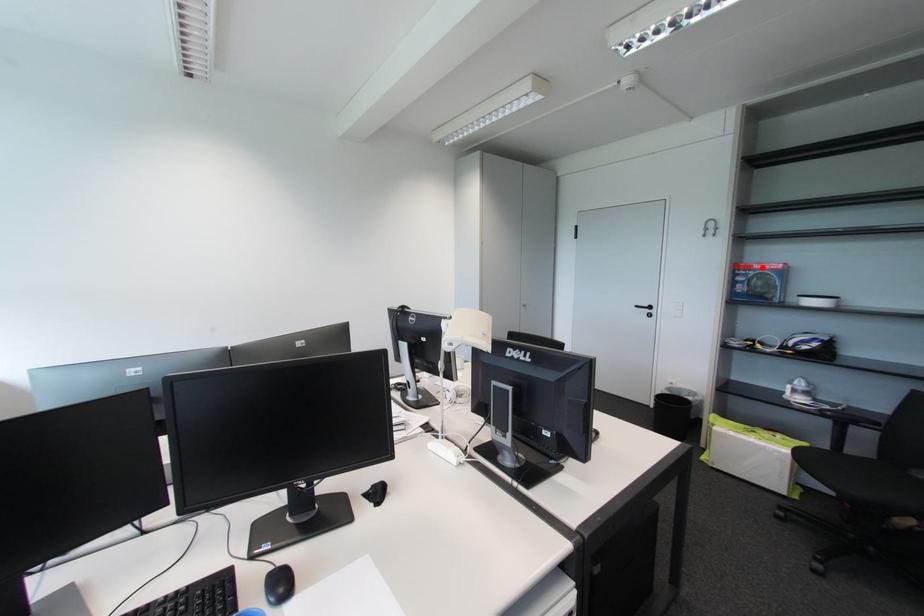
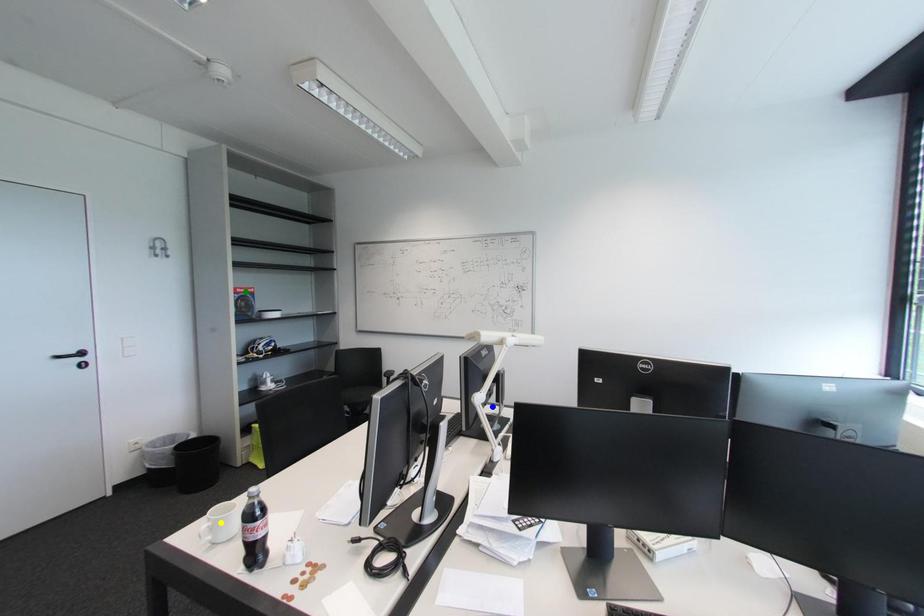
Question: I am providing you with two images of the same scene from different viewpoints. A red point is marked on the first image. You are given multiple points on the second image. Which mark in image 2 goes with the point in image 1?

Choices:
 (A) blue point
 (B) yellow point
 (C) green point

Answer: (C)